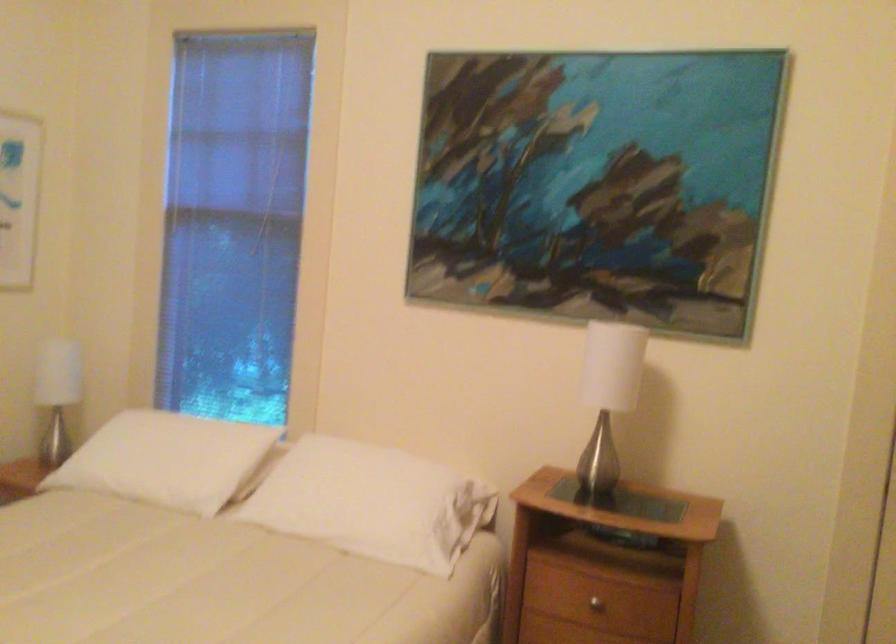
The height and width of the screenshot is (644, 896). Describe the element at coordinates (597, 601) in the screenshot. I see `the drawer handle` at that location.